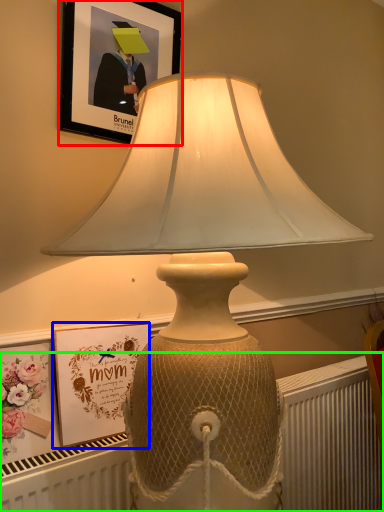
Question: Which object is positioned closest to picture frame (highlighted by a red box)? Select from picture frame (highlighted by a blue box) and radiator (highlighted by a green box).

Choices:
 (A) picture frame
 (B) radiator

Answer: (A)